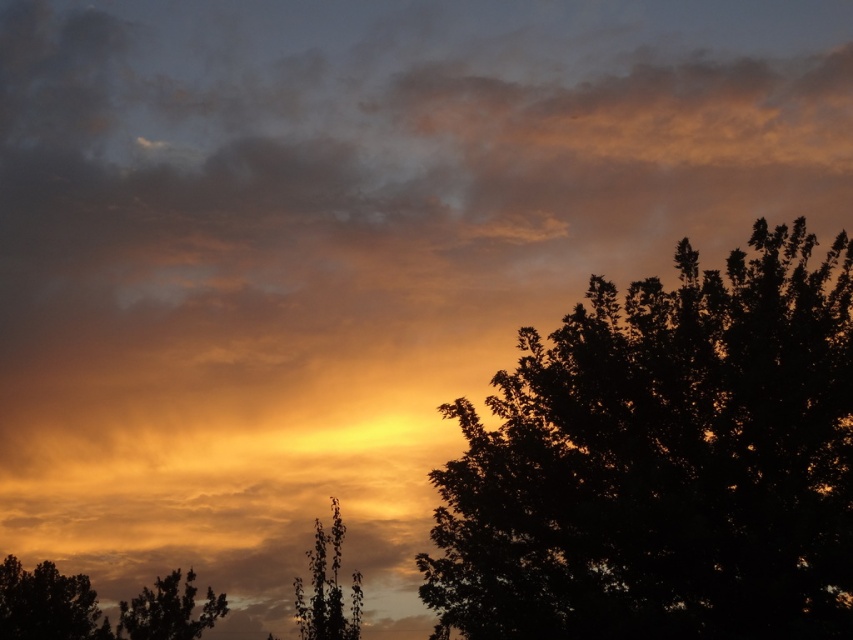
Is silhouette leafy tree at right positioned behind green leafy tree at center?

No, silhouette leafy tree at right is closer to the viewer.

Identify the location of silhouette leafy tree at right. (663, 464).

Is silhouette leafy tree at lower left positioned before green leafy tree at center?

No, silhouette leafy tree at lower left is behind green leafy tree at center.

Can you confirm if silhouette leafy tree at lower left is positioned below green leafy tree at center?

Correct, silhouette leafy tree at lower left is located below green leafy tree at center.

Does point (177, 630) come behind point (345, 625)?

Yes, point (177, 630) is behind point (345, 625).

Find the location of `silhouette leafy tree at lower left`. silhouette leafy tree at lower left is located at coordinates (167, 611).

Describe the element at coordinates (663, 464) in the screenshot. Image resolution: width=853 pixels, height=640 pixels. I see `silhouette leafy tree at right` at that location.

Who is lower down, silhouette leafy tree at right or silhouette leafy tree at lower left?

silhouette leafy tree at lower left is lower down.

Does point (764, 368) come in front of point (154, 584)?

Yes, it is.

Find the location of a particular element. The height and width of the screenshot is (640, 853). silhouette leafy tree at right is located at coordinates (663, 464).